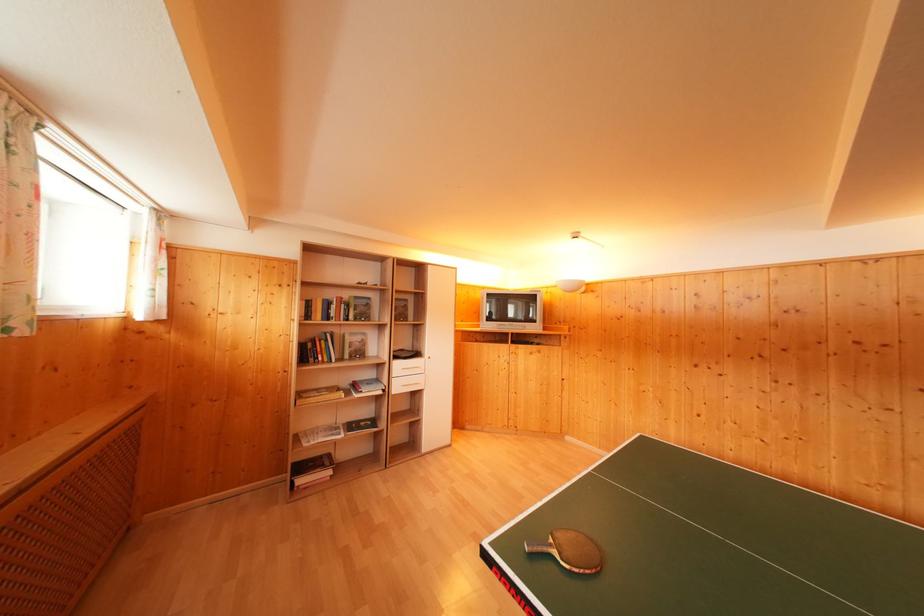
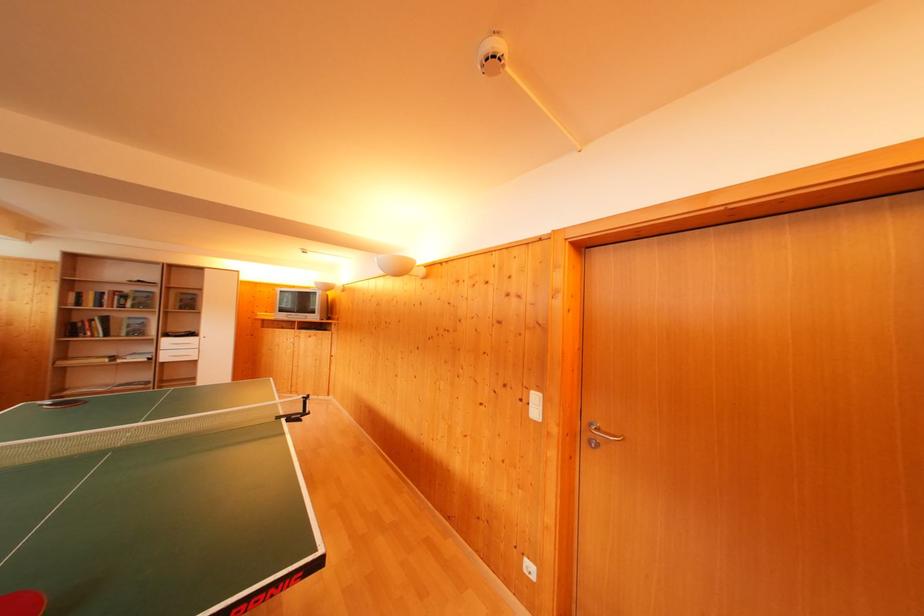
The point at (x=350, y=300) is marked in the first image. Where is the corresponding point in the second image?

(131, 294)